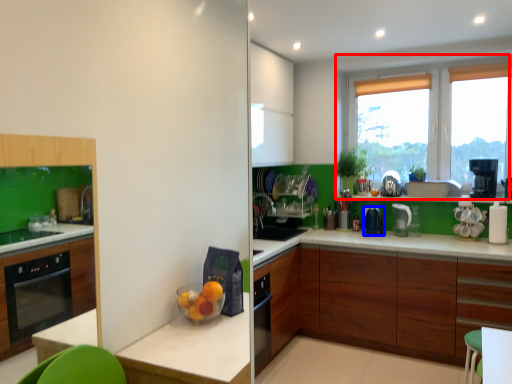
Question: Which of the following is the closest to the observer, window (highlighted by a red box) or kitchen appliance (highlighted by a blue box)?

Choices:
 (A) window
 (B) kitchen appliance

Answer: (A)